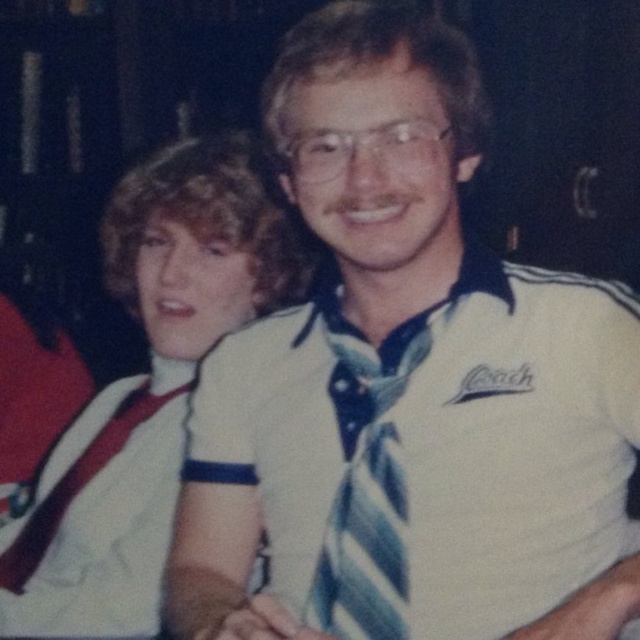
Is point (426, 588) closer to viewer compared to point (157, 426)?

Yes, it is.

Is the position of white cotton shirt at center less distant than that of white cotton shirt at left?

Yes.

What do you see at coordinates (406, 385) in the screenshot? I see `white cotton shirt at center` at bounding box center [406, 385].

Where is `white cotton shirt at center`? The height and width of the screenshot is (640, 640). white cotton shirt at center is located at coordinates (406, 385).

Does white cotton shirt at center appear on the right side of blue striped tie at center?

Yes, white cotton shirt at center is to the right of blue striped tie at center.

Between white cotton shirt at center and blue striped tie at center, which one appears on the left side from the viewer's perspective?

blue striped tie at center is more to the left.

The image size is (640, 640). What do you see at coordinates (406, 385) in the screenshot?
I see `white cotton shirt at center` at bounding box center [406, 385].

The width and height of the screenshot is (640, 640). I want to click on white cotton shirt at center, so click(406, 385).

What do you see at coordinates (406, 385) in the screenshot? Image resolution: width=640 pixels, height=640 pixels. I see `white cotton shirt at center` at bounding box center [406, 385].

This screenshot has width=640, height=640. I want to click on white cotton shirt at center, so click(406, 385).